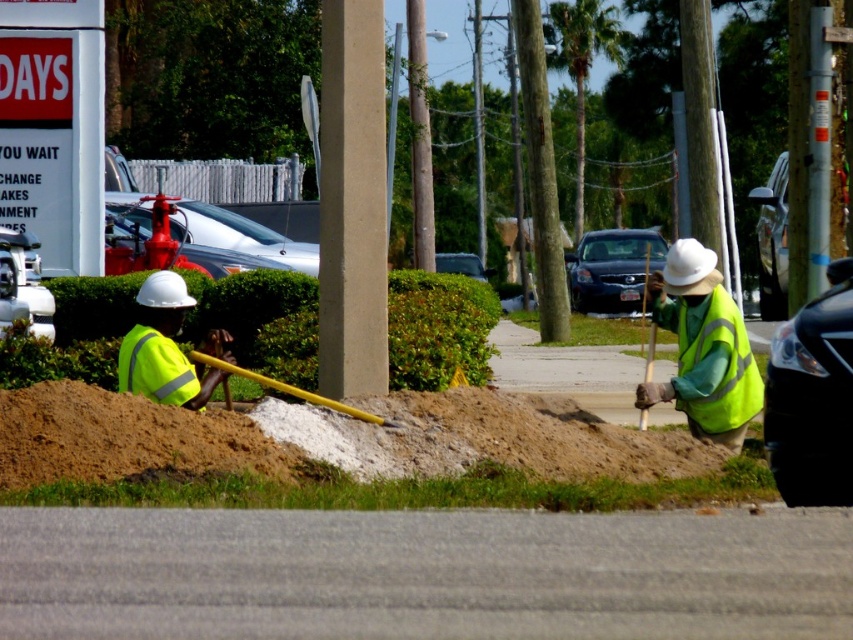
Question: Can you confirm if green reflective safety vest at right is positioned to the left of yellow plastic shovel at lower center?

Choices:
 (A) no
 (B) yes

Answer: (A)

Question: Which object is farther from the camera taking this photo?

Choices:
 (A) high-visibility yellow vest at left
 (B) high-visibility yellow vest at right
 (C) brown sandy dirt at center

Answer: (B)

Question: Does brown sandy dirt at center appear over high-visibility yellow safety vest at lower left?

Choices:
 (A) yes
 (B) no

Answer: (B)

Question: Which of these objects is positioned farthest from the green reflective safety vest at right?

Choices:
 (A) brown sandy dirt at lower left
 (B) high-visibility yellow safety vest at lower left

Answer: (A)

Question: Does brown sandy dirt at lower left come behind green reflective safety vest at right?

Choices:
 (A) no
 (B) yes

Answer: (A)

Question: Which of these objects is positioned closest to the high-visibility yellow vest at right?

Choices:
 (A) green reflective safety vest at right
 (B) brown sandy dirt at center
 (C) high-visibility yellow vest at left
 (D) yellow plastic shovel at lower center

Answer: (A)